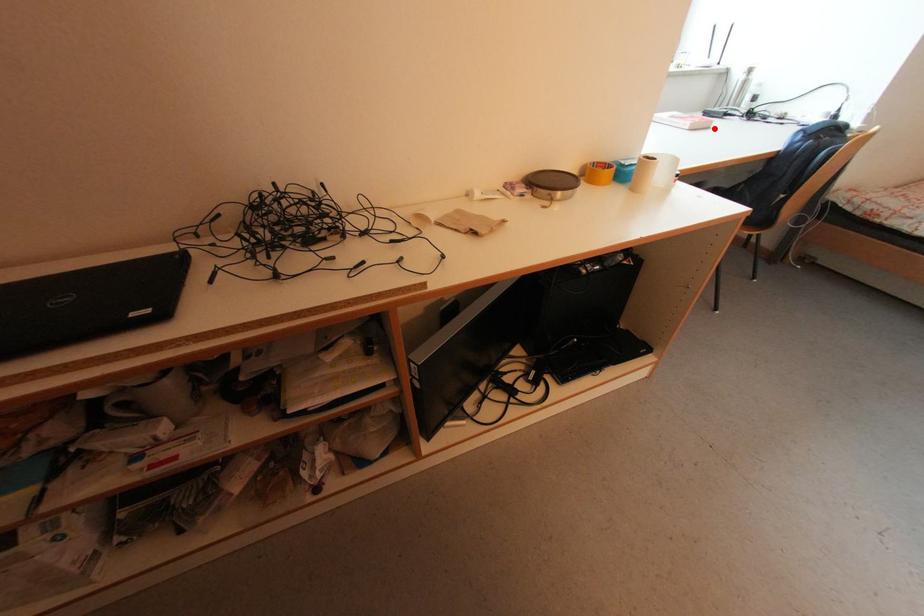
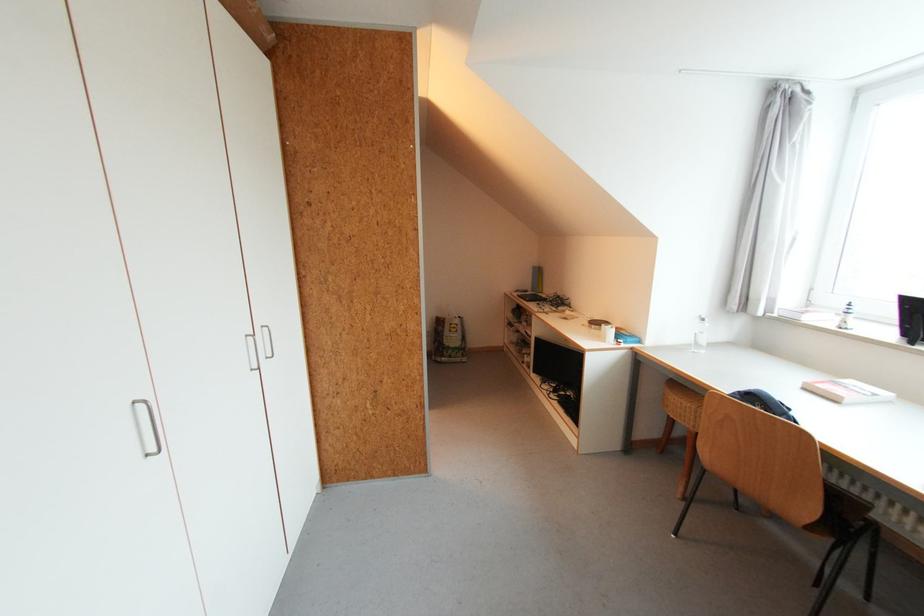
The point at the highlighted location is marked in the first image. Where is the corresponding point in the second image?

(841, 403)